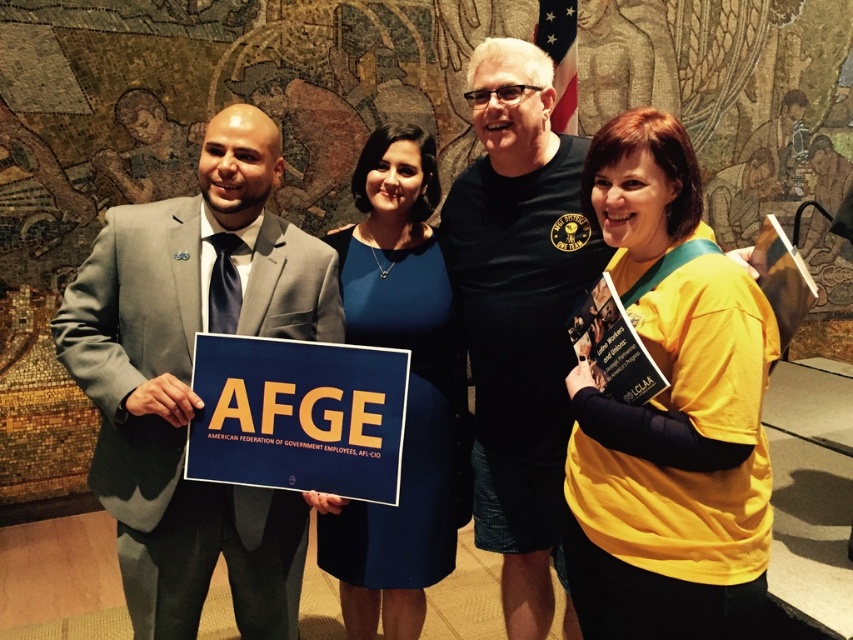
You are a photographer adjusting the lighting for a group photo. You need to ensure that the blue fabric dress at center and the yellow paper sign at center are both well lit. Given that your spotlight has a maximum effective range of 16 inches, will you need to adjust the spotlight position to cover both objects?

The distance between the blue fabric dress at center and the yellow paper sign at center is 15.96 inches, which is just under the spotlight range of 16 inches. Therefore, the spotlight can cover both objects without needing adjustment.

You are organizing a charity event and need to place a 1.2 meter wide banner between the yellow jersey at center and the blue fabric dress at center. Based on their widths, will the banner fit between them?

The yellow jersey at center has a lesser width compared to blue fabric dress at center. Since the banner is 1.2 meters wide, it depends on the actual distance between them. However, the description only provides information about their widths, not the space between. Therefore, we cannot determine if the banner will fit based on the given details.

In the formal setting with a mosaic backdrop, you see a blue fabric dress at center and a yellow paper sign at center. Which object is positioned to the right of the other?

The blue fabric dress at center is to the right of the yellow paper sign at center.